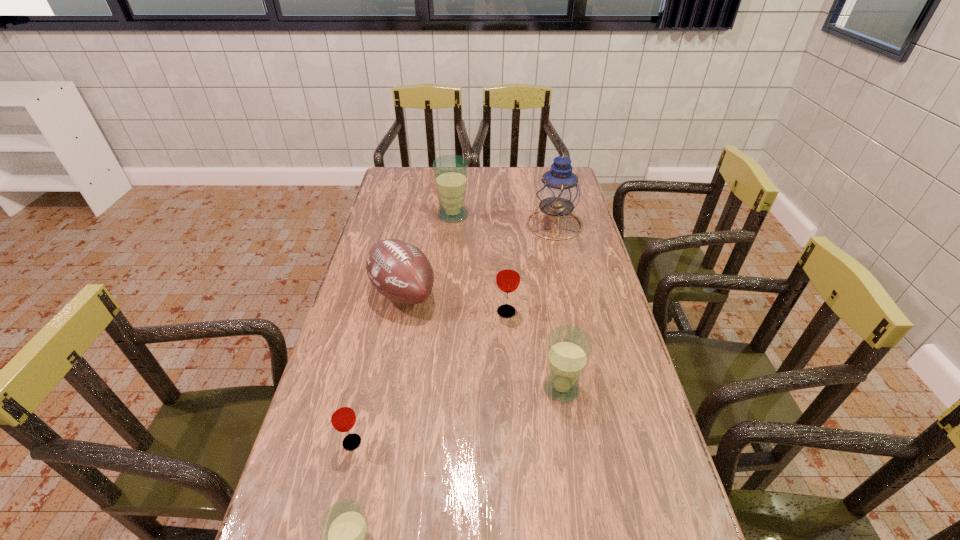
Identify the location of free space between the football (American) and the farthest blue glass. The width and height of the screenshot is (960, 540). (428, 254).

I want to click on object that is the closest to the lantern, so click(450, 172).

I want to click on object that is the fourth nearest to the fourth nearest glass, so click(450, 172).

Choose which glass is the third nearest neighbor to the blue lantern. Please provide its 2D coordinates. Your answer should be formatted as a tuple, i.e. [(x, y)], where the tuple contains the x and y coordinates of a point satisfying the conditions above.

[(569, 348)]

Image resolution: width=960 pixels, height=540 pixels. I want to click on glass that can be found as the fourth closest to the rightmost glass, so click(x=450, y=172).

The width and height of the screenshot is (960, 540). Find the location of `the second closest blue glass to the smallest blue glass`. the second closest blue glass to the smallest blue glass is located at coordinates (450, 172).

Find the location of a particular element. The image size is (960, 540). blue glass that is the second closest to the rightmost blue glass is located at coordinates (450, 172).

Where is `vacant point that satisfies the following two spatial constraints: 1. on the back side of the second blue glass from right to left; 2. on the left side of the football (American)`? vacant point that satisfies the following two spatial constraints: 1. on the back side of the second blue glass from right to left; 2. on the left side of the football (American) is located at coordinates (418, 215).

Image resolution: width=960 pixels, height=540 pixels. What are the coordinates of `vacant point that satisfies the following two spatial constraints: 1. on the back side of the second farthest blue glass; 2. on the right side of the nearer red glass` in the screenshot? It's located at (365, 388).